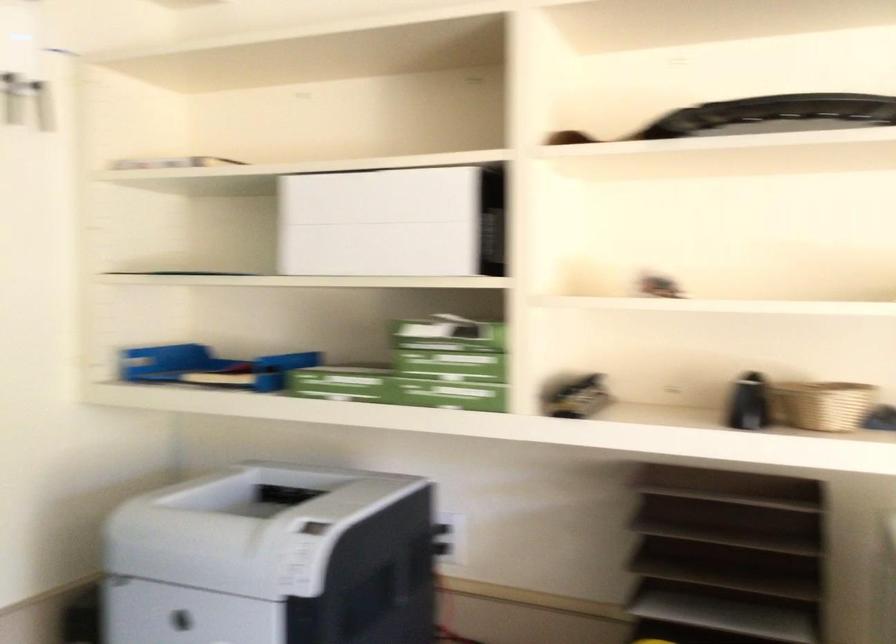
Find the location of a particular element. white box is located at coordinates (380, 223).